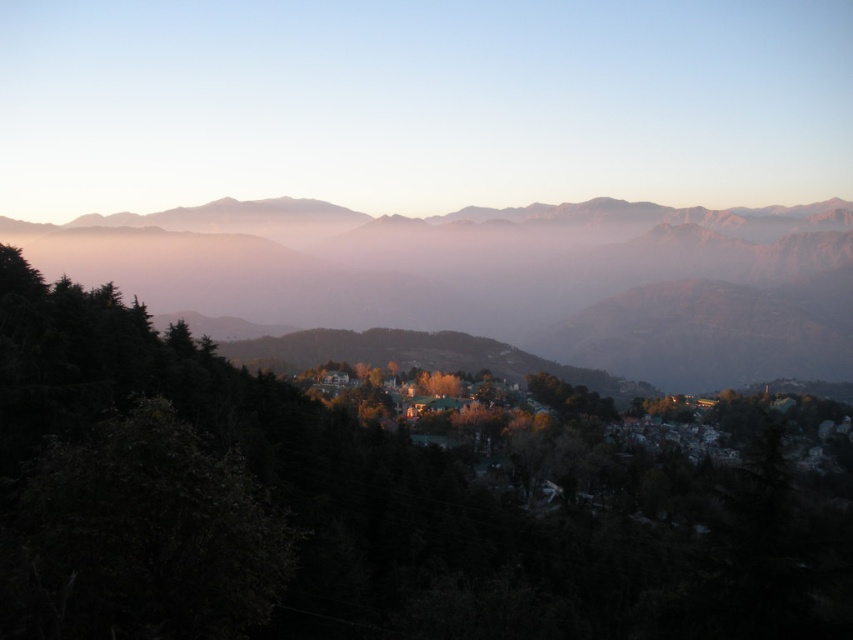
You are an outdoor enthusiast planning a hiking route. You see the green matte tree at center and the gray rocky mountain range at center. Which object is positioned lower in the scene?

The green matte tree at center is positioned below the gray rocky mountain range at center, so it is lower in the scene.